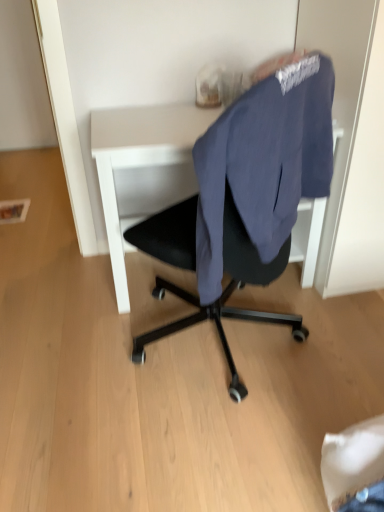
What do you see at coordinates (246, 199) in the screenshot? I see `matte blue jacket at center` at bounding box center [246, 199].

The height and width of the screenshot is (512, 384). What are the coordinates of `matte blue jacket at center` in the screenshot? It's located at (246, 199).

Measure the distance between point (241, 101) and camera.

The depth of point (241, 101) is 37.40 inches.

The height and width of the screenshot is (512, 384). Find the location of `matte blue jacket at center`. matte blue jacket at center is located at coordinates (246, 199).